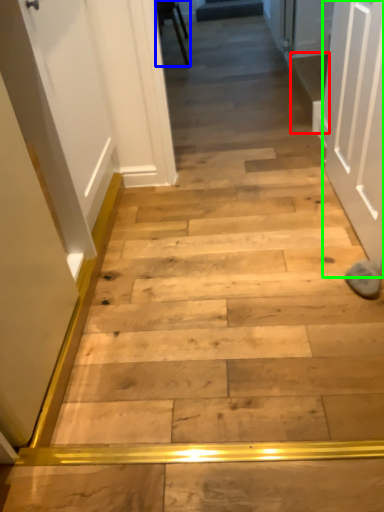
Question: Which is nearer to the stairwell (highlighted by a red box)? furniture (highlighted by a blue box) or door (highlighted by a green box).

Choices:
 (A) furniture
 (B) door

Answer: (B)